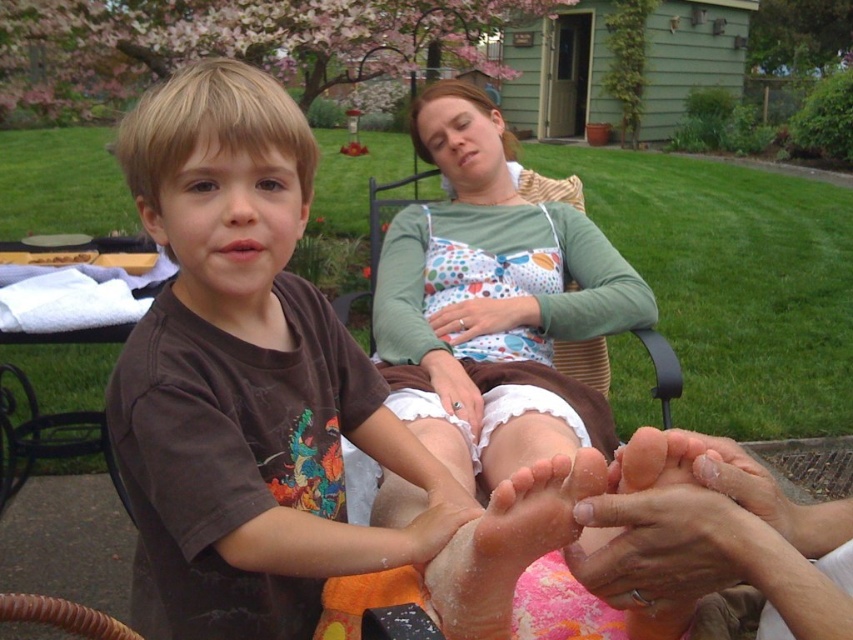
Question: Is brown cotton shirt at upper left smaller than matte white hand at center?

Choices:
 (A) yes
 (B) no

Answer: (B)

Question: Is brown cotton shirt at upper left positioned behind matte white hand at center?

Choices:
 (A) no
 (B) yes

Answer: (A)

Question: Estimate the real-world distances between objects in this image. Which object is closer to the smooth skin feet at lower right?

Choices:
 (A) matte white hand at center
 (B) polka dot fabric dress at center
 (C) brown cotton shirt at upper left
 (D) sandy skin feet at lower center

Answer: (D)

Question: Estimate the real-world distances between objects in this image. Which object is farther from the brown cotton shirt at upper left?

Choices:
 (A) polka dot fabric dress at center
 (B) sandy skin feet at lower center
 (C) matte white hand at center

Answer: (C)

Question: Is brown cotton shirt at upper left thinner than sandy skin feet at lower center?

Choices:
 (A) yes
 (B) no

Answer: (B)

Question: Among these points, which one is farthest from the camera?

Choices:
 (A) (123, 160)
 (B) (669, 596)
 (C) (480, 422)
 (D) (589, 296)

Answer: (D)